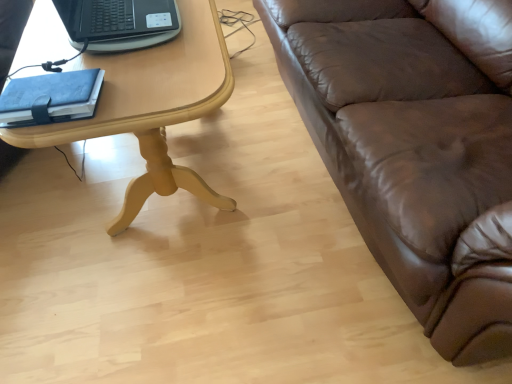
I want to click on vacant area that lies to the right of blue leather notebook at left, so click(x=138, y=88).